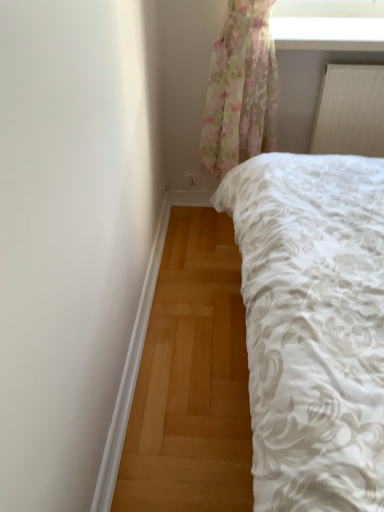
Question: From the image's perspective, is transparent floral curtain at upper center located above or below white smooth trim at lower left?

Choices:
 (A) above
 (B) below

Answer: (A)

Question: From a real-world perspective, is transparent floral curtain at upper center physically located above or below white smooth trim at lower left?

Choices:
 (A) below
 (B) above

Answer: (B)

Question: Considering the real-world distances, which object is closest to the transparent floral curtain at upper center?

Choices:
 (A) white smooth trim at lower left
 (B) white matte radiator at upper right

Answer: (B)

Question: Estimate the real-world distances between objects in this image. Which object is closer to the transparent floral curtain at upper center?

Choices:
 (A) white matte radiator at upper right
 (B) white smooth trim at lower left

Answer: (A)